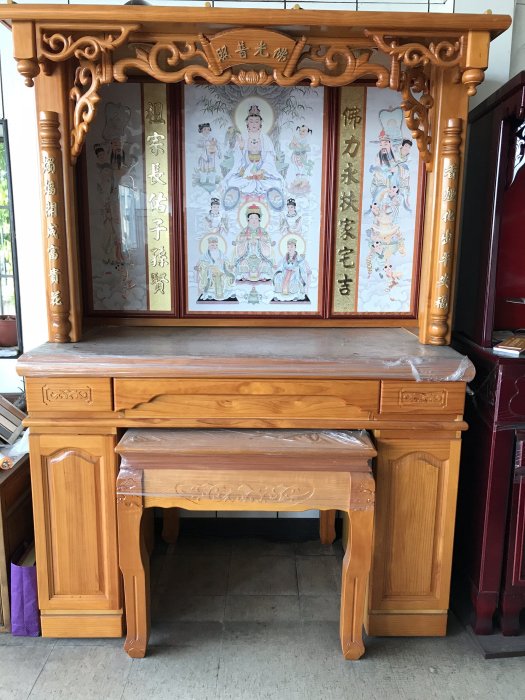
The image size is (525, 700). I want to click on drawer, so click(250, 392).